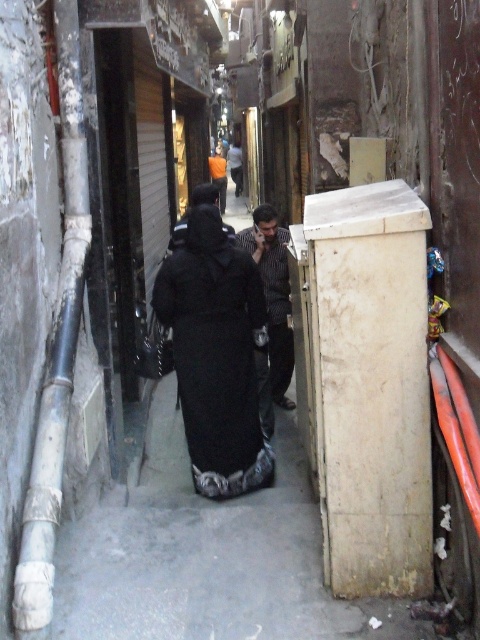
You are a photographer trying to capture both the black matte dress at center and the striped shirt at center in a single frame. Given their spatial relationship, which one should you focus on first to ensure both are in the frame?

Since the black matte dress at center occupies less space than the striped shirt at center, you should focus on the striped shirt at center first as it takes up more space and will help frame the composition better.

You are a photographer standing in the alleyway and want to capture both the black matte dress at center and the striped shirt at center in a single frame. Which clothing item will appear lower in your photo?

The black matte dress at center will appear lower in the photo because it is located below the striped shirt at center.